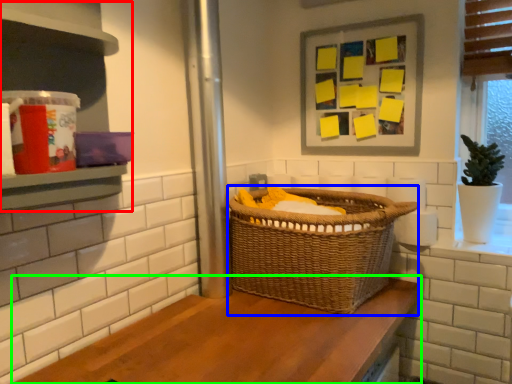
Question: Which is nearer to the shelf (highlighted by a red box)? basket (highlighted by a blue box) or counter (highlighted by a green box).

Choices:
 (A) basket
 (B) counter

Answer: (B)